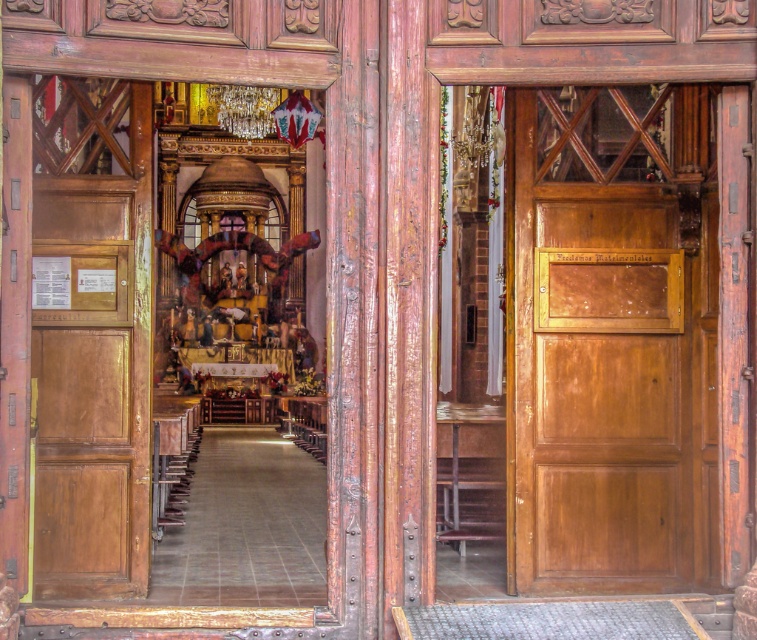
Question: Can you confirm if matte wood door at right is smaller than matte wood door at left?

Choices:
 (A) no
 (B) yes

Answer: (A)

Question: Which point is farther to the camera?

Choices:
 (A) (712, 369)
 (B) (94, 512)

Answer: (A)

Question: Is matte wood door at right closer to camera compared to matte wood door at left?

Choices:
 (A) yes
 (B) no

Answer: (B)

Question: Does matte wood door at right appear on the left side of matte wood door at left?

Choices:
 (A) yes
 (B) no

Answer: (B)